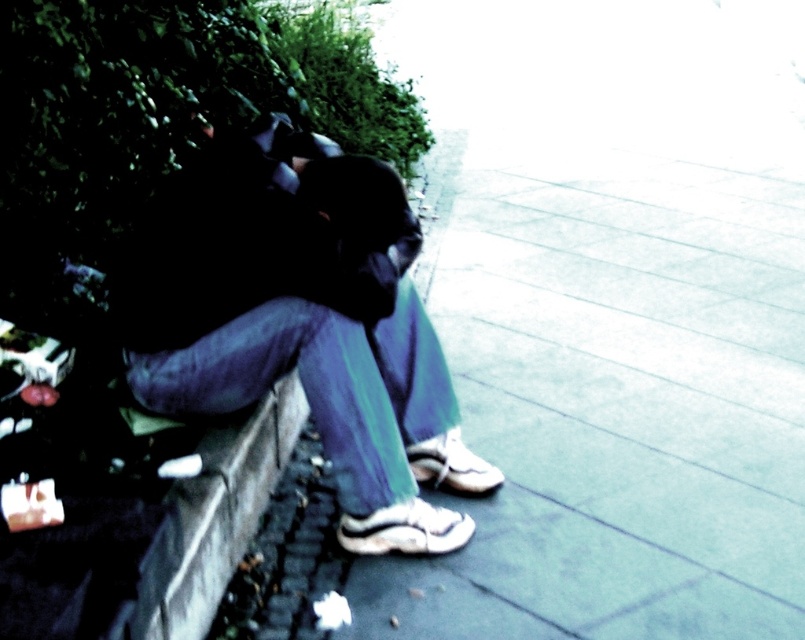
You are standing in a park and want to take a photo of the person sitting on the low stone wall. The camera you are using has a maximum focus range of 1.5 meters. Can you focus on the point at coordinates point (x=543, y=573) without moving closer?

The point (x=543, y=573) is 1.21 meters away from the camera, so yes, the camera can focus on it since it is within the 1.5 meters maximum focus range.

You are a delivery person who needs to place a package on the ground near the person sitting on the wall. The package is heavy and must be placed on a stable surface. Which object from the scene should you choose, the smooth concrete pavement at center or the matte black jacket at center?

The smooth concrete pavement at center is above the matte black jacket at center, so the smooth concrete pavement at center is the stable surface to place the package.

You are a delivery person who needs to place a package on the ground near the person sitting on the wall. The package is 1 meter wide. Can you place it between the smooth concrete pavement at center and the matte black jacket at center?

The smooth concrete pavement at center is positioned on the right side of matte black jacket at center. Since the package is 1 meter wide, it might not fit between them if the distance between the two objects is less than 1 meter. However, the exact distance isn